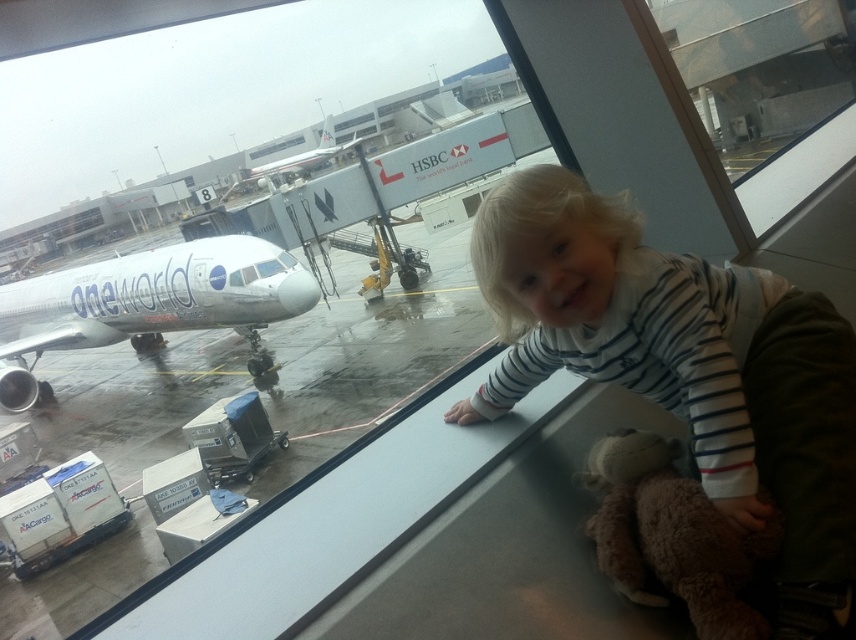
Is white striped shirt at upper right positioned behind transparent glass window at center?

No.

You are a GUI agent. You are given a task and a screenshot of the screen. Output one action in this format:
    pyautogui.click(x=<x>, y=<y>)
    Task: Click on the white striped shirt at upper right
    This screenshot has height=640, width=856.
    Given the screenshot: What is the action you would take?
    pyautogui.click(x=685, y=368)

Does white glossy airplane at left have a larger size compared to silver metallic airplane at center?

Indeed, white glossy airplane at left has a larger size compared to silver metallic airplane at center.

Between white glossy airplane at left and silver metallic airplane at center, which one has less height?

Standing shorter between the two is white glossy airplane at left.

Where is `white glossy airplane at left`? white glossy airplane at left is located at coordinates (147, 301).

Who is shorter, white glossy airplane at left or brown plush teddy bear at lower right?

With less height is brown plush teddy bear at lower right.

Does white glossy airplane at left appear under brown plush teddy bear at lower right?

No, white glossy airplane at left is not below brown plush teddy bear at lower right.

Image resolution: width=856 pixels, height=640 pixels. What are the coordinates of `white glossy airplane at left` in the screenshot? It's located at (147, 301).